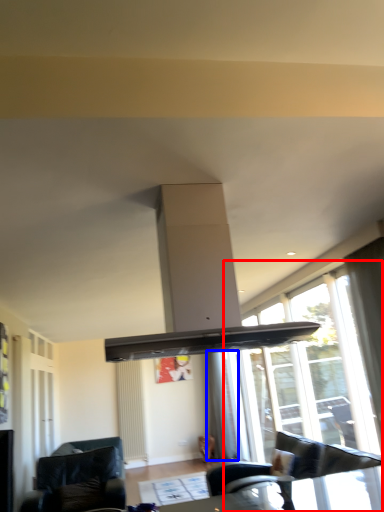
Question: Among these objects, which one is farthest to the camera, window (highlighted by a red box) or curtain (highlighted by a blue box)?

Choices:
 (A) window
 (B) curtain

Answer: (B)